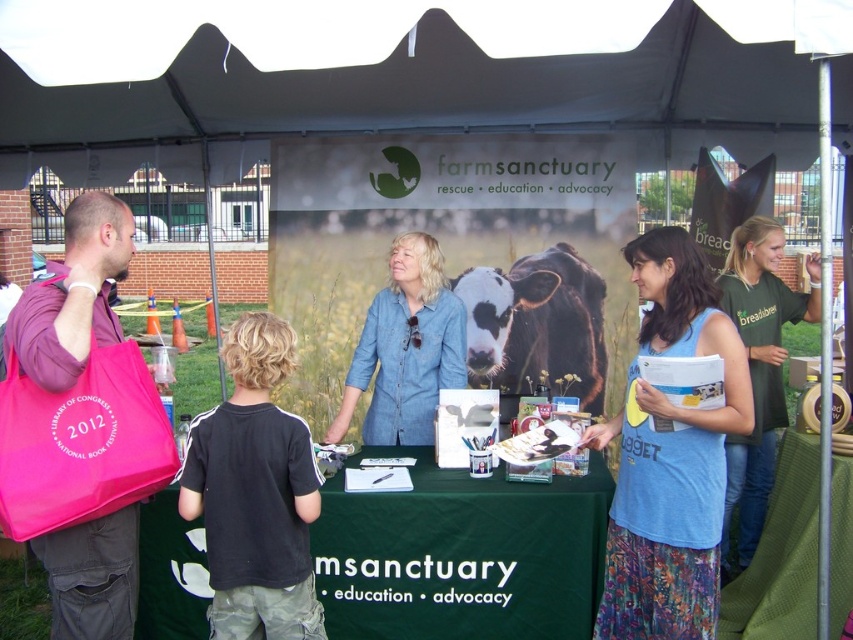
Question: Which is nearer to the white fabric canopy at upper center?

Choices:
 (A) green fabric table at center
 (B) pink fabric bag at left
 (C) green jersey at right

Answer: (C)

Question: Estimate the real-world distances between objects in this image. Which object is closer to the white fabric canopy at upper center?

Choices:
 (A) denim shirt at center
 (B) pink fabric bag at left
 (C) green jersey at right

Answer: (A)

Question: Among these points, which one is nearest to the camera?

Choices:
 (A) (144, 522)
 (B) (813, 19)
 (C) (416, 332)
 (D) (683, 307)

Answer: (B)

Question: Can you confirm if green fabric table at center is thinner than green jersey at right?

Choices:
 (A) yes
 (B) no

Answer: (B)

Question: Can you confirm if white fabric canopy at upper center is positioned below green fabric table at center?

Choices:
 (A) yes
 (B) no

Answer: (B)

Question: Does pink fabric bag at left have a lesser width compared to denim shirt at center?

Choices:
 (A) no
 (B) yes

Answer: (B)